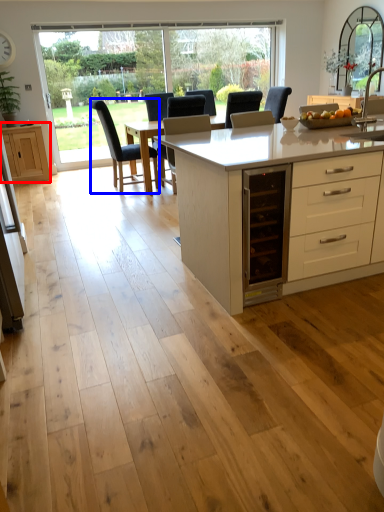
Question: Which of the following is the farthest to the observer, cabinetry (highlighted by a red box) or chair (highlighted by a blue box)?

Choices:
 (A) cabinetry
 (B) chair

Answer: (A)